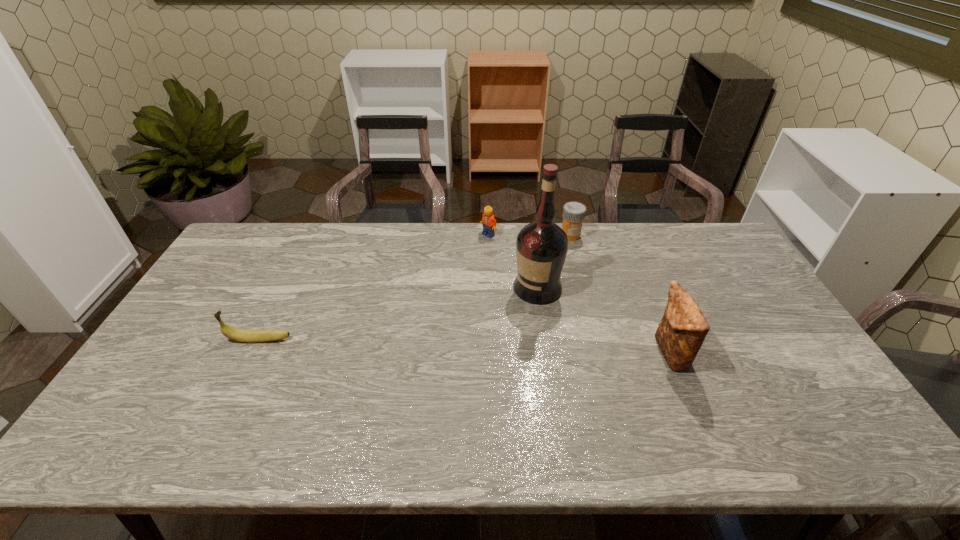
Identify the location of vacant space on the desktop that is between the leftmost object and the clutch bag and is positioned on the label side of the second object from right to left. The image size is (960, 540). (511, 348).

The image size is (960, 540). I want to click on free space on the desktop that is between the banana and the rightmost object and is positioned on the surface of the third farthest object, so click(x=461, y=347).

Identify the location of free space on the desktop that is between the leftmost object and the fourth shortest object and is positioned on the front-facing side of the Lego. (412, 345).